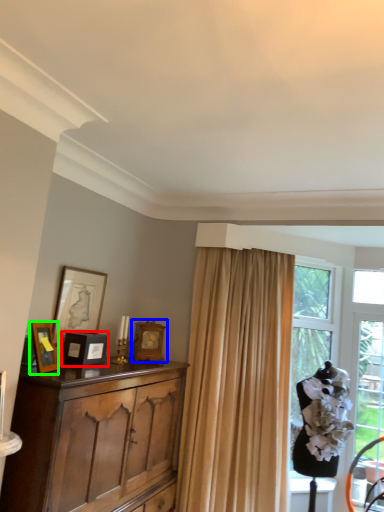
Question: Which object is positioned closest to picture frame (highlighted by a red box)? Select from picture frame (highlighted by a blue box) and picture frame (highlighted by a green box).

Choices:
 (A) picture frame
 (B) picture frame

Answer: (B)